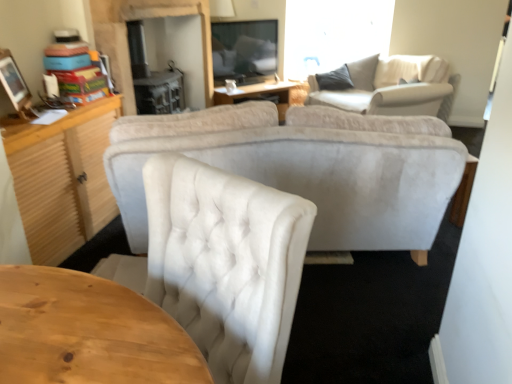
Question: From the image's perspective, is light gray fabric couch at upper right below wooden table at center?

Choices:
 (A) no
 (B) yes

Answer: (A)

Question: Does light gray fabric couch at upper right have a lesser height compared to wooden table at center?

Choices:
 (A) no
 (B) yes

Answer: (A)

Question: Considering the relative sizes of light gray fabric couch at upper right and wooden table at center in the image provided, is light gray fabric couch at upper right wider than wooden table at center?

Choices:
 (A) no
 (B) yes

Answer: (B)

Question: From a real-world perspective, is light gray fabric couch at upper right positioned over wooden table at center based on gravity?

Choices:
 (A) no
 (B) yes

Answer: (B)

Question: Would you consider light gray fabric couch at upper right to be distant from wooden table at center?

Choices:
 (A) yes
 (B) no

Answer: (B)

Question: Would you say light gray fabric couch at upper right is to the left or to the right of white tufted fabric chair at center in the picture?

Choices:
 (A) right
 (B) left

Answer: (A)

Question: Is point (375, 54) positioned closer to the camera than point (195, 261)?

Choices:
 (A) closer
 (B) farther

Answer: (B)

Question: Based on their sizes in the image, would you say light gray fabric couch at upper right is bigger or smaller than white tufted fabric chair at center?

Choices:
 (A) big
 (B) small

Answer: (A)

Question: From a real-world perspective, is light gray fabric couch at upper right above or below white tufted fabric chair at center?

Choices:
 (A) below
 (B) above

Answer: (A)

Question: From the image's perspective, is white tufted fabric chair at center located above or below wooden table at center?

Choices:
 (A) below
 (B) above

Answer: (A)

Question: In terms of width, does white tufted fabric chair at center look wider or thinner when compared to wooden table at center?

Choices:
 (A) thin
 (B) wide

Answer: (B)

Question: From their relative heights in the image, would you say white tufted fabric chair at center is taller or shorter than wooden table at center?

Choices:
 (A) short
 (B) tall

Answer: (B)

Question: Considering their positions, is white tufted fabric chair at center located in front of or behind wooden table at center?

Choices:
 (A) front
 (B) behind

Answer: (A)

Question: Considering the positions of light gray fabric couch at upper right and wooden table at center in the image, is light gray fabric couch at upper right taller or shorter than wooden table at center?

Choices:
 (A) short
 (B) tall

Answer: (B)

Question: Considering the positions of point (345, 102) and point (287, 94), is point (345, 102) closer or farther from the camera than point (287, 94)?

Choices:
 (A) closer
 (B) farther

Answer: (A)